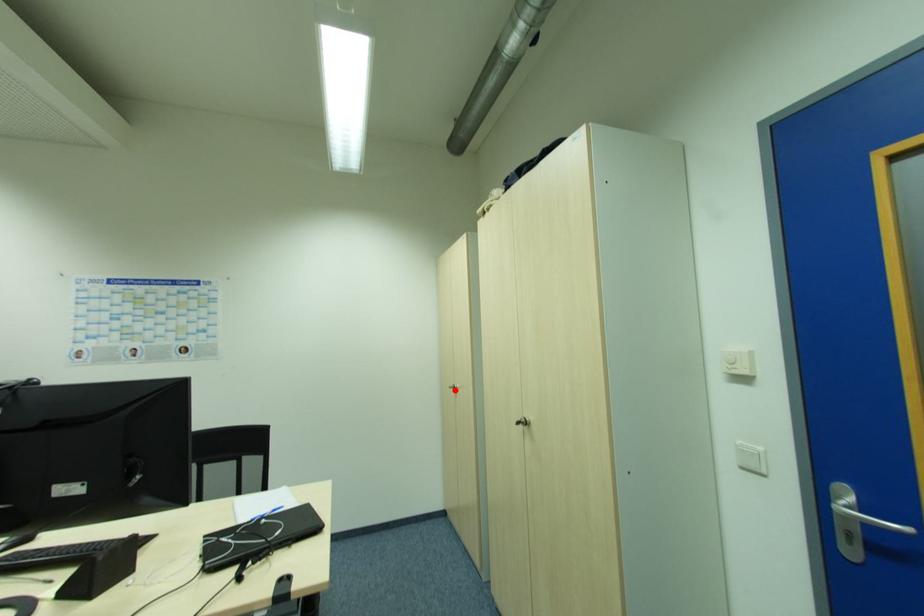
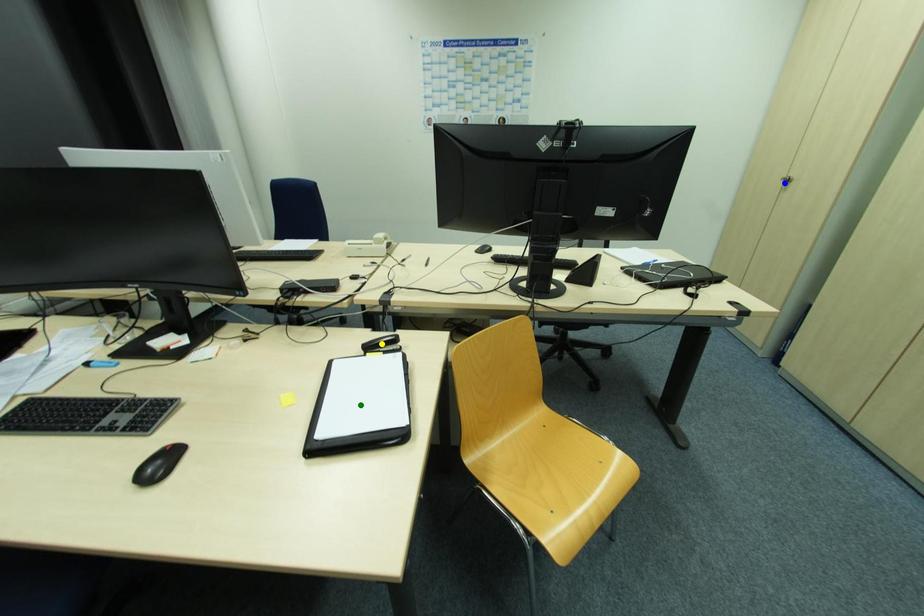
Question: I am providing you with two images of the same scene from different viewpoints. A red point is marked on the first image. You are given multiple points on the second image. In image 2, which mark is for the same physical point as the one in image 1?

Choices:
 (A) green point
 (B) yellow point
 (C) blue point

Answer: (C)